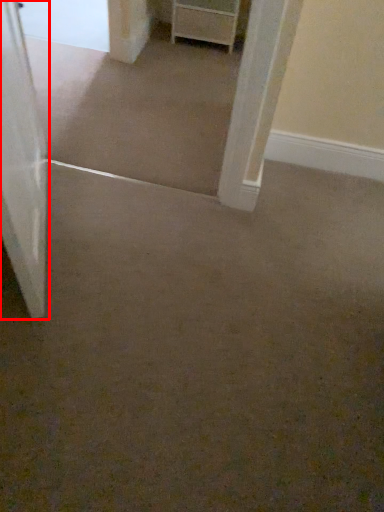
Question: From the image's perspective, where is door (annotated by the red box) located in relation to chest of drawers in the image?

Choices:
 (A) above
 (B) below

Answer: (B)